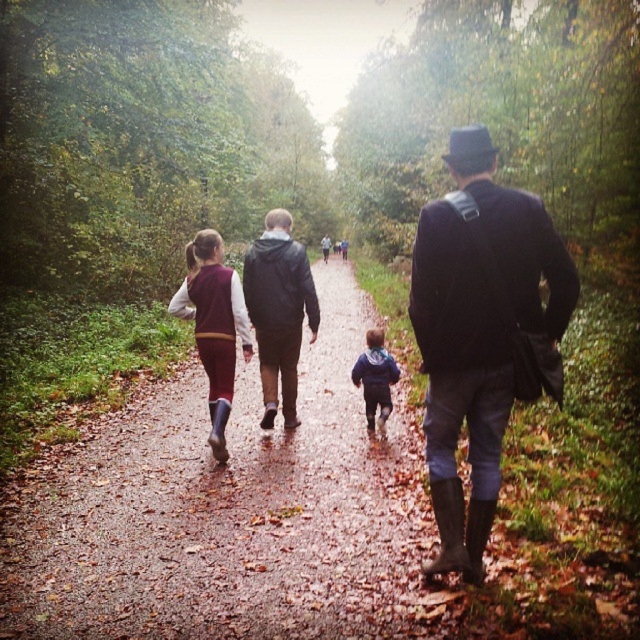
Question: Based on their relative distances, which object is farther from the blue fleece jacket at center?

Choices:
 (A) dark blue wool coat at center
 (B) brown textured path at center
 (C) leather jacket at center

Answer: (A)

Question: Does blue fleece jacket at center appear under dark blue jacket at center?

Choices:
 (A) no
 (B) yes

Answer: (B)

Question: In this image, where is brown textured path at center located relative to leather jacket at center?

Choices:
 (A) left
 (B) right

Answer: (A)

Question: Which of the following is the farthest from the observer?

Choices:
 (A) (212, 326)
 (B) (60, 588)

Answer: (A)

Question: Among these points, which one is farthest from the camera?

Choices:
 (A) (332, 273)
 (B) (545, 316)

Answer: (A)

Question: Can you confirm if brown textured path at center is positioned to the right of maroon sweater at center?

Choices:
 (A) yes
 (B) no

Answer: (A)